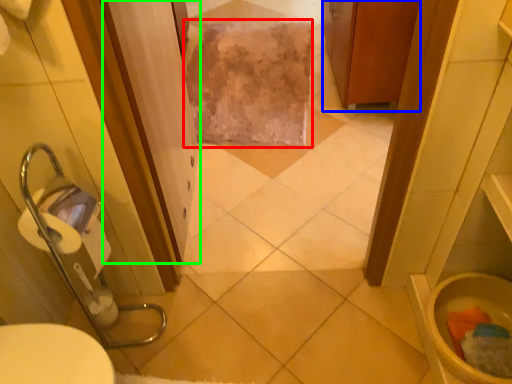
Question: Which object is positioned farthest from bath towel (highlighted by a red box)? Select from cabinetry (highlighted by a blue box) and screen door (highlighted by a green box).

Choices:
 (A) cabinetry
 (B) screen door

Answer: (B)